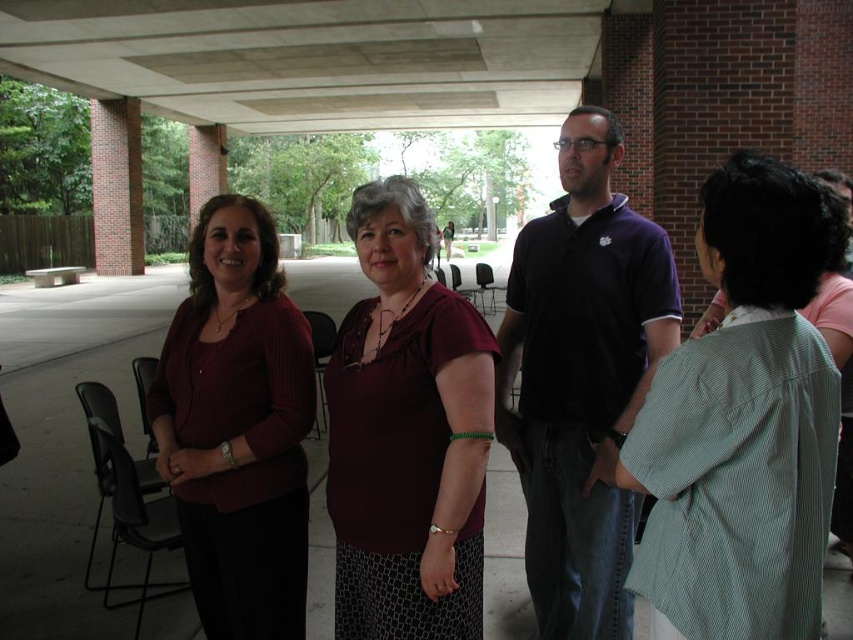
You are standing at the point labeled as point (790, 385) and want to greet someone who is 1.26 meters away from you. Is the person you want to greet within a comfortable conversational distance?

Yes, the person you want to greet is exactly 1.26 meters away from the point (790, 385), which falls within the typical comfortable conversational distance range of about 1 to 2 meters.

You are a photographer setting up for an event and need to ensure that the maroon fabric blouse at center and the matte maroon sweater at center are within a 12 inch frame. Can you fit both into the frame?

The maroon fabric blouse at center and matte maroon sweater at center are 13.11 inches apart, which exceeds the 12 inch frame. Therefore, both cannot be captured within the frame simultaneously.

You are a photographer trying to capture a group photo of the four individuals. The purple cotton polo shirt at center is represented by point (581,380). Where should you position the camera to ensure the purple cotton polo shirt at center is centered in the frame?

To center the purple cotton polo shirt at center in the frame, position the camera directly facing the point (581,380) so that the shirt is at the center of the image.